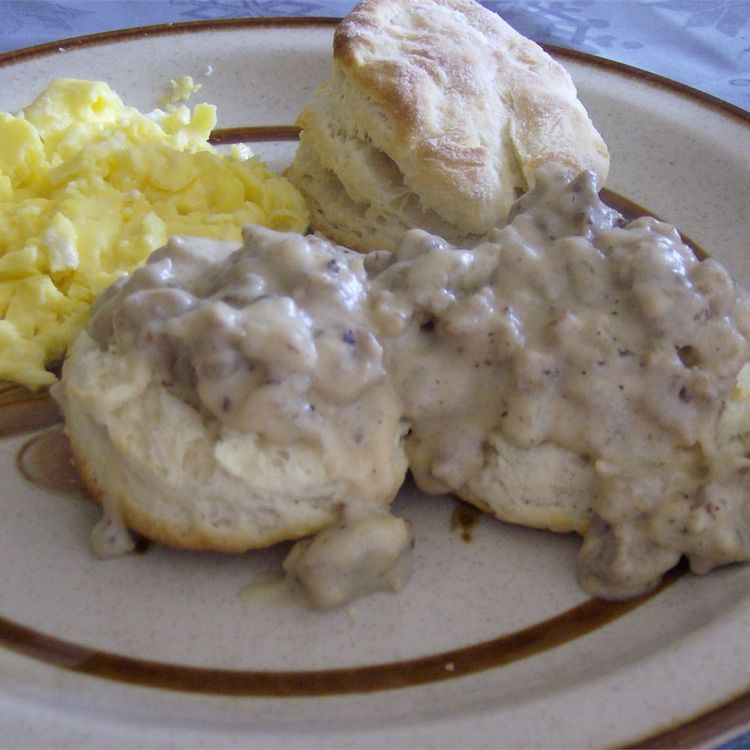
This screenshot has height=750, width=750. Find the location of `pattern on tablecloth`. pattern on tablecloth is located at coordinates (543, 21).